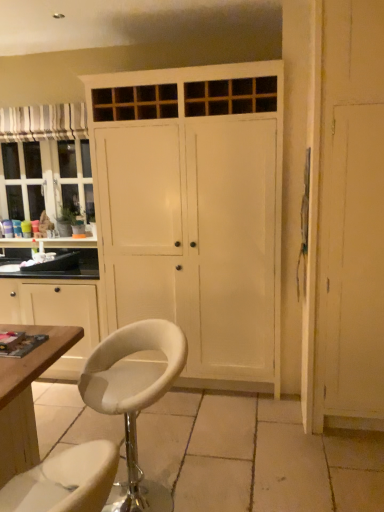
Find the location of a particular element. This screenshot has height=512, width=384. vacant area that lies to the right of white leather stool at center is located at coordinates (231, 478).